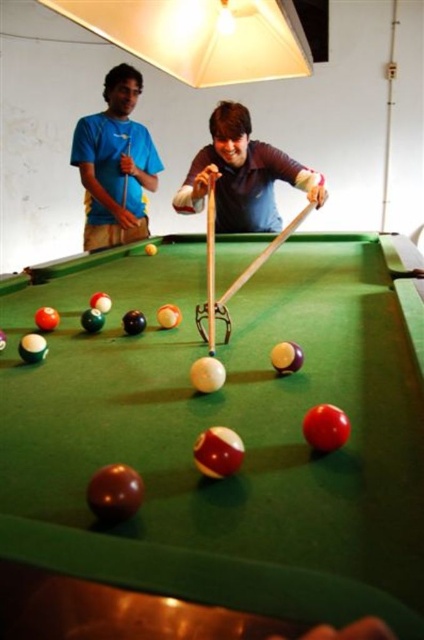
Question: Which of the following is the farthest from the observer?

Choices:
 (A) (92, 244)
 (B) (128, 147)
 (C) (198, 180)

Answer: (A)

Question: Which of these objects is positioned closest to the matte blue shirt at upper left?

Choices:
 (A) smooth wooden cue at center
 (B) green felt billiard table at center
 (C) matte brown shirt at center

Answer: (C)

Question: Is matte blue shirt at upper left to the right of wooden cue at center from the viewer's perspective?

Choices:
 (A) yes
 (B) no

Answer: (B)

Question: Which point is farther from the camera taking this photo?

Choices:
 (A) tap(295, 166)
 (B) tap(282, 228)

Answer: (B)

Question: Does green felt billiard table at center come behind matte brown shirt at center?

Choices:
 (A) no
 (B) yes

Answer: (A)

Question: Is matte blue shirt at upper left below matte brown shirt at center?

Choices:
 (A) yes
 (B) no

Answer: (B)